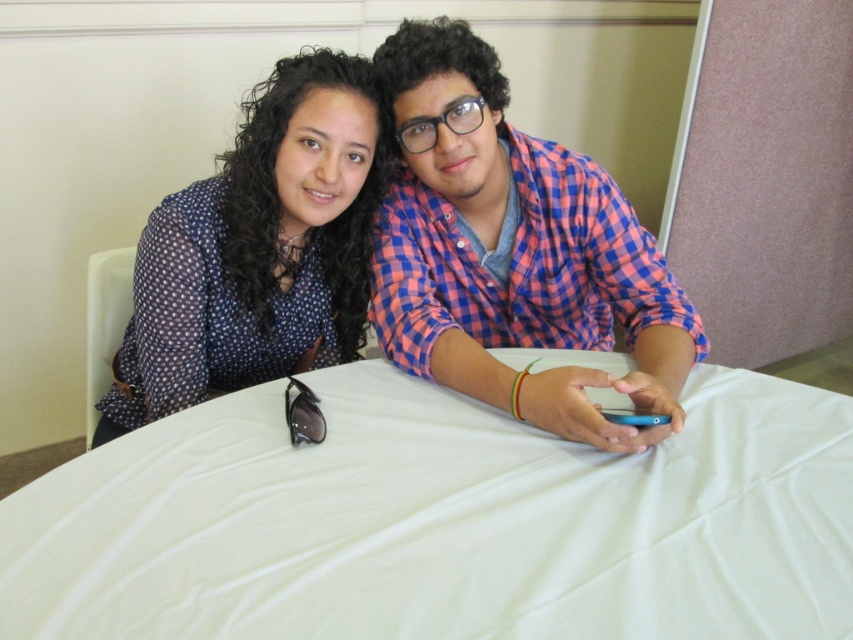
You are a photographer setting up a shoot at the table with the matte blue shirt at center and the black plastic goggles at lower center. You want to ensure that the goggles are visible in the background behind the shirt. Will your current setup allow this?

The matte blue shirt at center is in front of the black plastic goggles at lower center, so the goggles will be partially or fully obscured by the shirt in the photo. Adjust the setup to move the shirt or goggles to achieve the desired visibility.

You are a photographer taking a picture of the matte blue blouse at upper left and the black plastic goggles at lower center. Which object will appear larger in the photo?

The matte blue blouse at upper left will appear larger in the photo because it is closer to the viewer than the black plastic goggles at lower center.

You are standing in front of the table where the two people are sitting. You want to place a small object exactly at the point with coordinates point (514, 252). Which object from the scene will this point be located on?

The point (514, 252) is located on the matte blue shirt at center.